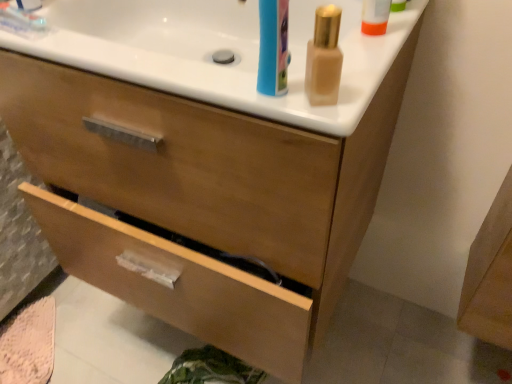
Where is `vacant area situated to the left side of satin gold bottle at upper right`? This screenshot has height=384, width=512. vacant area situated to the left side of satin gold bottle at upper right is located at coordinates (202, 82).